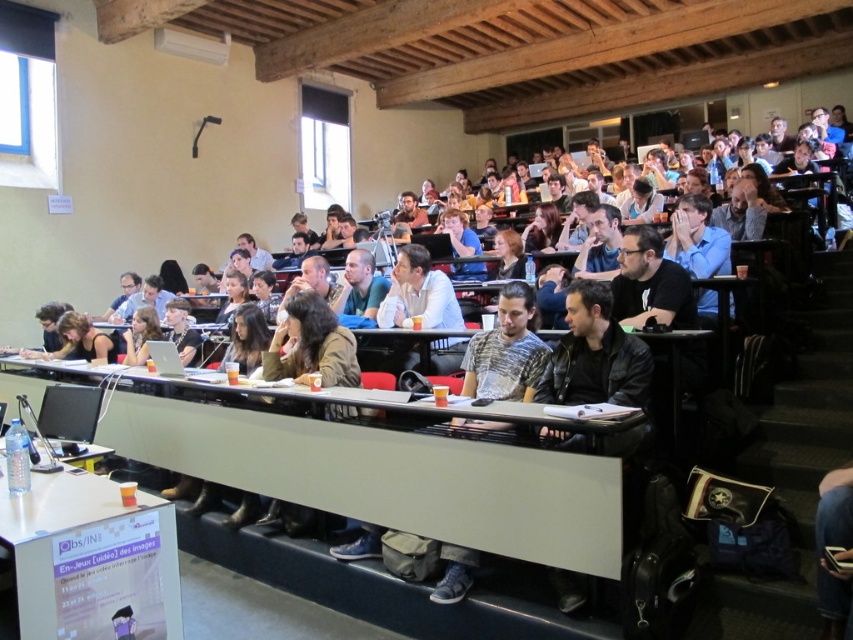
Between white plastic table at lower center and white plastic table at lower left, which one appears on the right side from the viewer's perspective?

From the viewer's perspective, white plastic table at lower center appears more on the right side.

Is point (607, 515) positioned before point (54, 492)?

Yes, it is in front of point (54, 492).

Is point (263, 481) positioned behind point (102, 634)?

Yes, it is.

Locate an element on the screen. white plastic table at lower center is located at coordinates (389, 476).